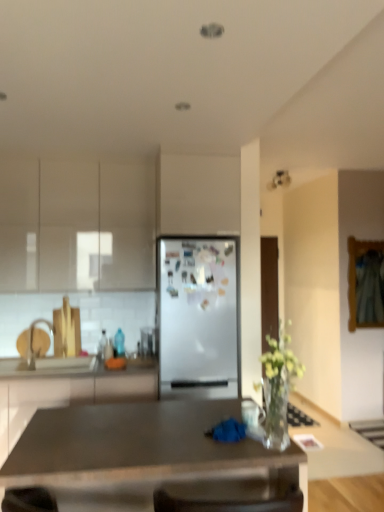
Locate an element on the screen. The image size is (384, 512). empty space that is ontop of matte gray desk at center (from a real-world perspective) is located at coordinates (137, 424).